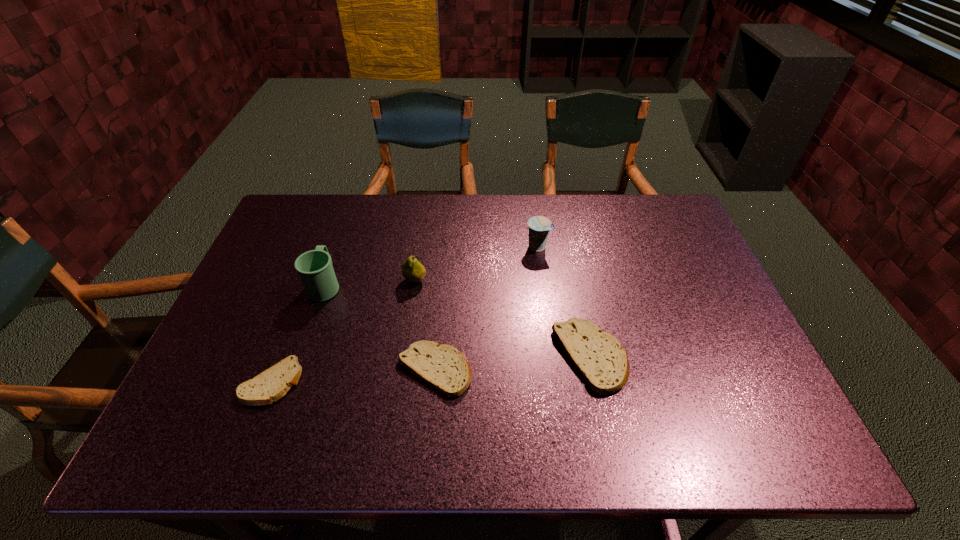
Please point a spot on the right to add another pita bread. Please provide its 2D coordinates. Your answer should be formatted as a tuple, i.e. [(x, y)], where the tuple contains the x and y coordinates of a point satisfying the conditions above.

[(740, 346)]